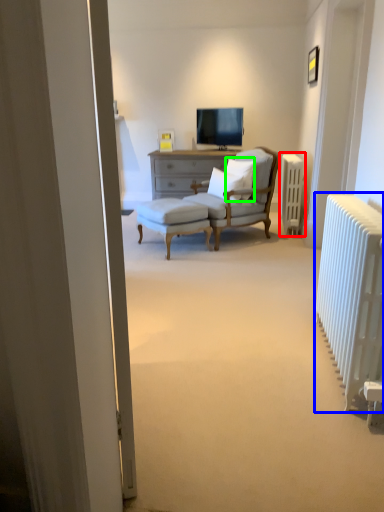
Question: Which object is positioned farthest from radiator (highlighted by a red box)? Select from radiator (highlighted by a blue box) and pillow (highlighted by a green box).

Choices:
 (A) radiator
 (B) pillow

Answer: (A)